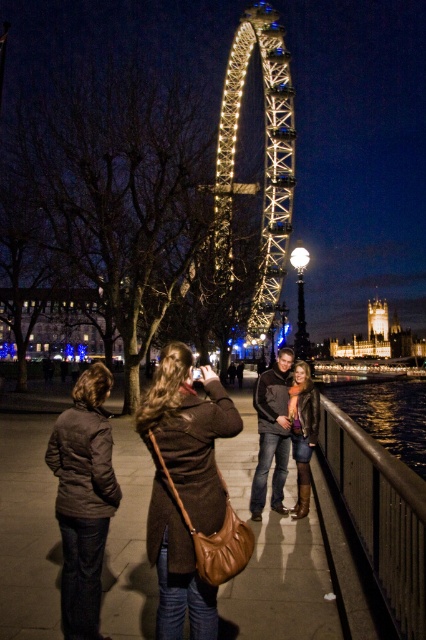
Between brown leather purse at center and stone tower at right, which one is positioned lower?

brown leather purse at center

You are a GUI agent. You are given a task and a screenshot of the screen. Output one action in this format:
    pyautogui.click(x=<x>, y=<y>)
    Task: Click on the brown leather purse at center
    This screenshot has height=640, width=426.
    Given the screenshot: What is the action you would take?
    pyautogui.click(x=184, y=486)

Image resolution: width=426 pixels, height=640 pixels. In order to click on brown leather purse at center in this screenshot , I will do `click(184, 486)`.

Can you confirm if brown leather purse at center is thinner than leather jacket at center?

In fact, brown leather purse at center might be wider than leather jacket at center.

Describe the element at coordinates (184, 486) in the screenshot. I see `brown leather purse at center` at that location.

At what (x,y) coordinates should I click in order to perform the action: click on brown leather purse at center. Please return your answer as a coordinate pair (x, y). Looking at the image, I should click on (184, 486).

Locate an element on the screen. The image size is (426, 640). illuminated steel ferris wheel at center is located at coordinates (264, 160).

Between illuminated steel ferris wheel at center and stone tower at right, which one has more height?

illuminated steel ferris wheel at center is taller.

Which is behind, point (270, 100) or point (379, 307)?

Positioned behind is point (379, 307).

Where is `illuminated steel ferris wheel at center`? Image resolution: width=426 pixels, height=640 pixels. illuminated steel ferris wheel at center is located at coordinates (264, 160).